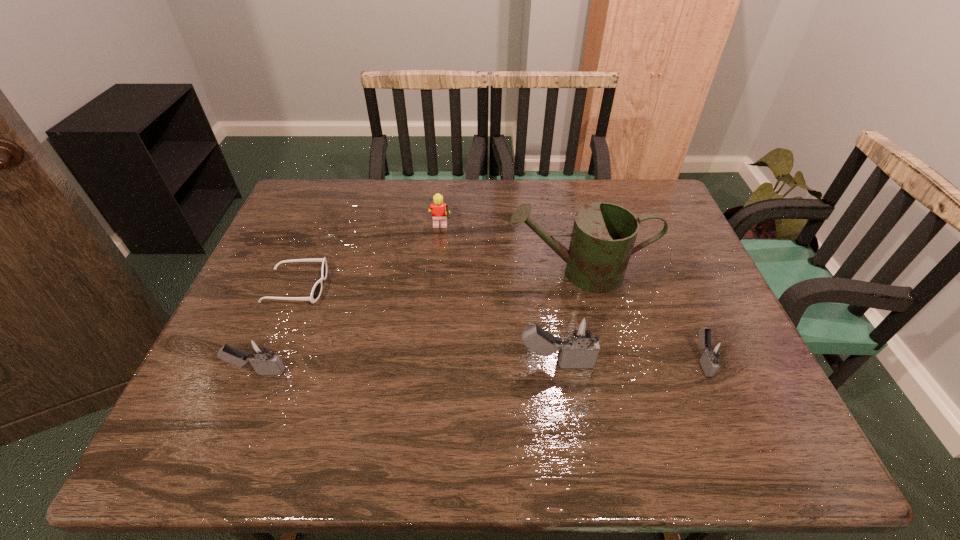
Identify the location of free location located on the back of the second tallest object. The image size is (960, 540). (545, 291).

Where is `vacant space located 0.180m on the left of the rightmost igniter`? This screenshot has width=960, height=540. vacant space located 0.180m on the left of the rightmost igniter is located at coordinates (612, 360).

You are a GUI agent. You are given a task and a screenshot of the screen. Output one action in this format:
    pyautogui.click(x=<x>, y=<y>)
    Task: Click on the free space located with the lenses of the sunglasses facing outward
    
    Given the screenshot: What is the action you would take?
    click(x=444, y=287)

Locate an element on the screen. The width and height of the screenshot is (960, 540). vacant space located with the spout on the tallest object is located at coordinates (452, 272).

Where is `free spot located 0.180m with the spout on the tallest object`? The image size is (960, 540). free spot located 0.180m with the spout on the tallest object is located at coordinates (441, 272).

Find the location of a particular element. This screenshot has height=540, width=960. free spot located with the spout on the tallest object is located at coordinates (478, 272).

I want to click on free space located 0.060m in front of the Lego with the accessory visible, so (x=471, y=230).

Where is `object present at the far edge`? object present at the far edge is located at coordinates (439, 210).

The image size is (960, 540). I want to click on igniter present at the left edge, so click(258, 352).

Find the location of a particular element. Image resolution: width=960 pixels, height=540 pixels. sunglasses located in the left edge section of the desktop is located at coordinates (316, 291).